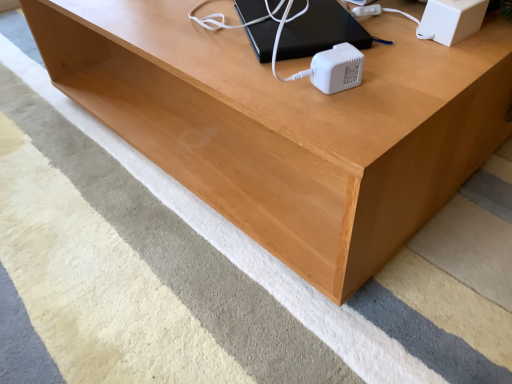
You are a GUI agent. You are given a task and a screenshot of the screen. Output one action in this format:
    pyautogui.click(x=<x>, y=<y>)
    Task: Click on the vacant area to the left of white plastic speaker at upper right
    This screenshot has width=512, height=384.
    Given the screenshot: What is the action you would take?
    pyautogui.click(x=383, y=46)